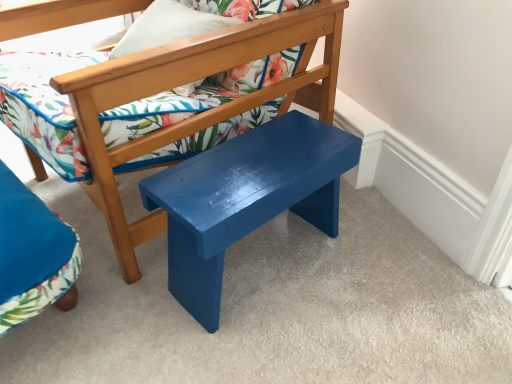
I want to click on free region under glossy wood stool at center (from a real-world perspective), so click(x=268, y=257).